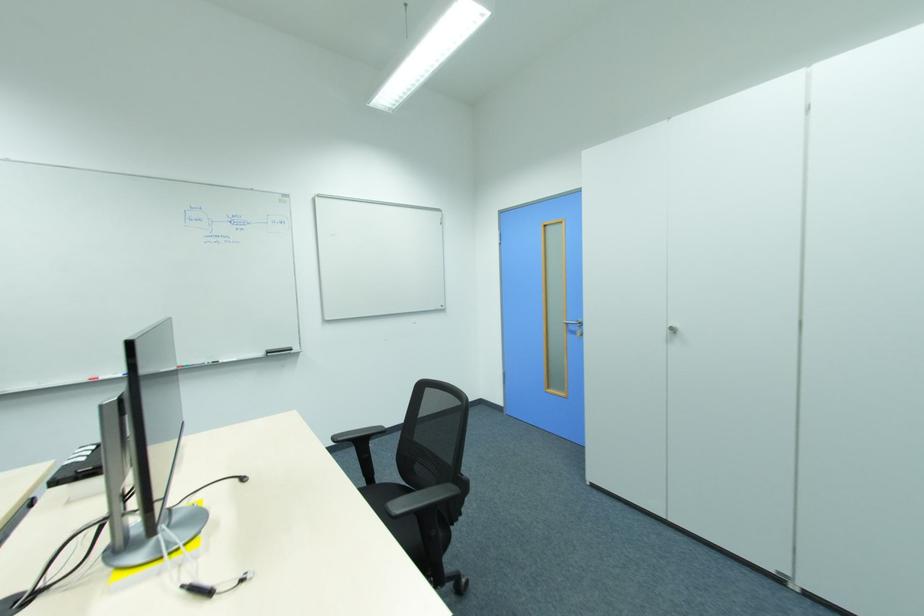
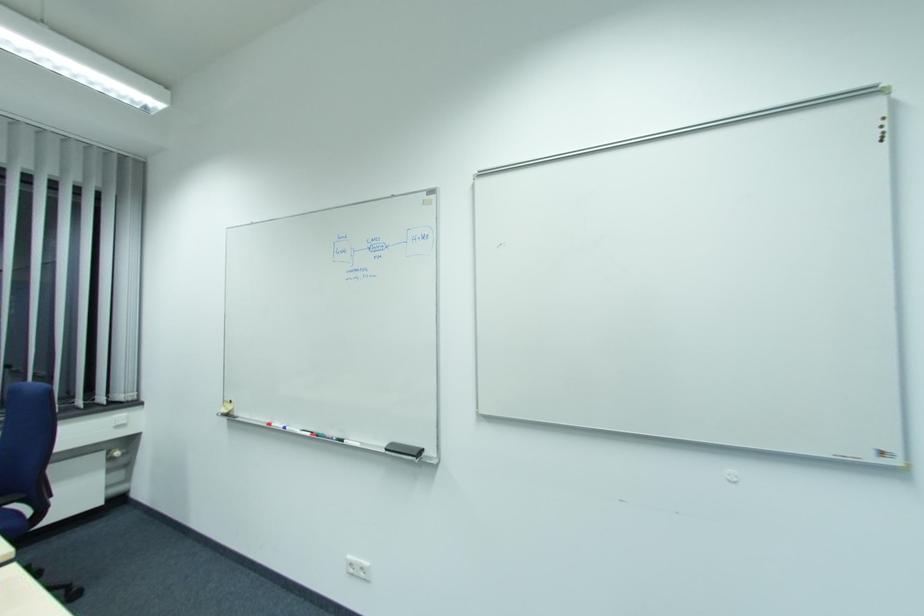
Question: I am providing you with two images of the same scene from different viewpoints. Please identify which objects are invisible in image2.

Choices:
 (A) black whiteboard eraser
 (B) white power outlet
 (C) chair sitting surface
 (D) none of these

Answer: (D)